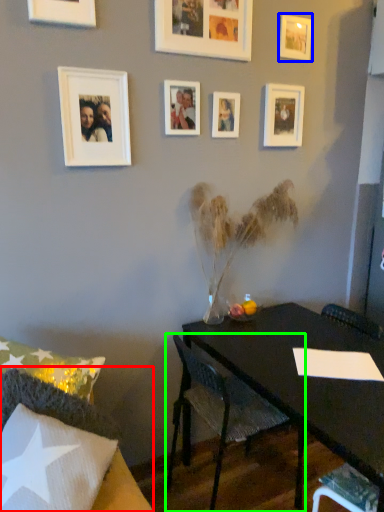
Question: Which is nearer to the chair (highlighted by a red box)? picture frame (highlighted by a blue box) or chair (highlighted by a green box).

Choices:
 (A) picture frame
 (B) chair

Answer: (B)